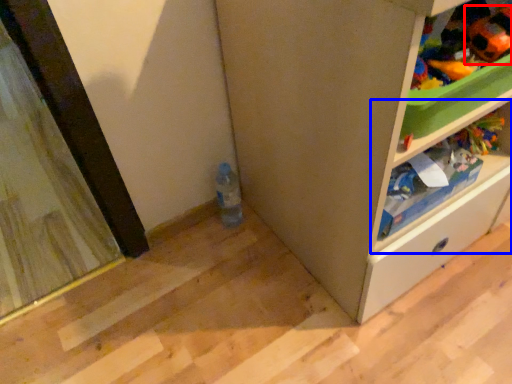
Question: Which object appears closest to the camera in this image, toy (highlighted by a red box) or shelf (highlighted by a blue box)?

Choices:
 (A) toy
 (B) shelf

Answer: (A)